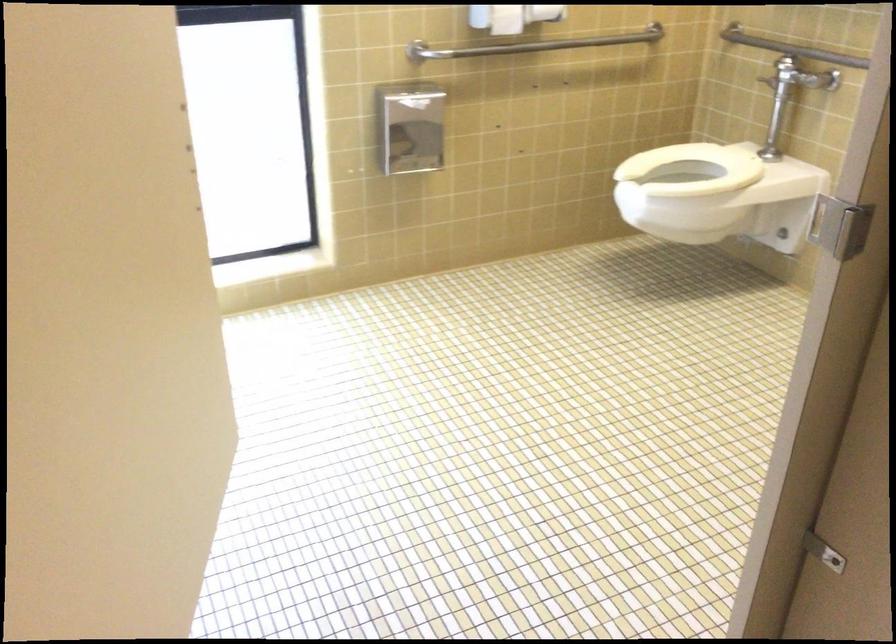
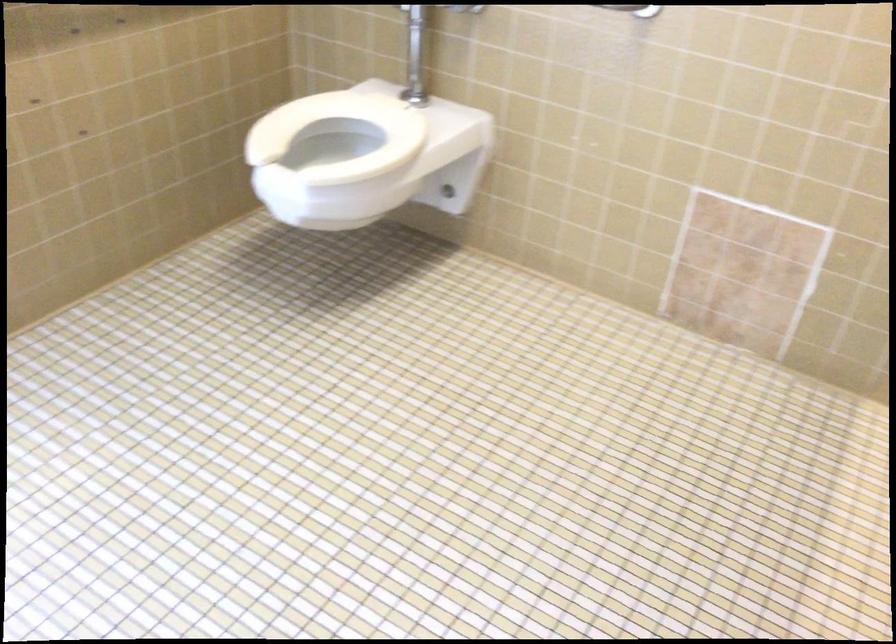
Question: The first image is from the beginning of the video and the second image is from the end. How did the camera likely rotate when shooting the video?

Choices:
 (A) Left
 (B) Right
 (C) Up
 (D) Down

Answer: (B)